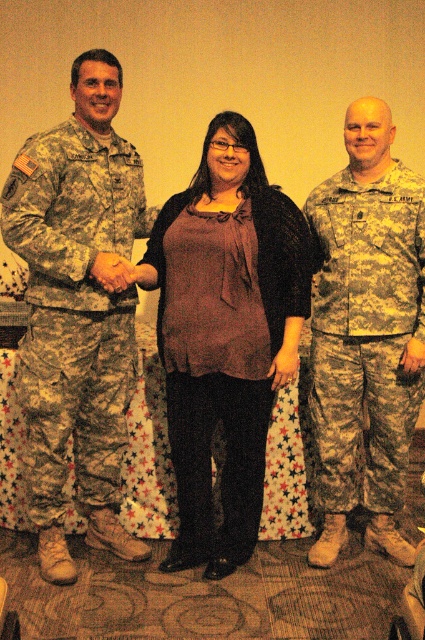
Question: Which object is farther from the camera taking this photo?

Choices:
 (A) matte brown blouse at center
 (B) camouflage uniform at left
 (C) camouflage uniform at center

Answer: (C)

Question: Does camouflage uniform at left appear on the right side of camouflage uniform at center?

Choices:
 (A) no
 (B) yes

Answer: (A)

Question: Which object is positioned closest to the matte brown blouse at center?

Choices:
 (A) camouflage uniform at left
 (B) camouflage uniform at center

Answer: (A)

Question: Is matte brown blouse at center bigger than camouflage uniform at center?

Choices:
 (A) no
 (B) yes

Answer: (B)

Question: Can you confirm if camouflage uniform at left is smaller than matte brown blouse at center?

Choices:
 (A) no
 (B) yes

Answer: (A)

Question: Which of the following is the farthest from the observer?

Choices:
 (A) matte brown blouse at center
 (B) camouflage uniform at left

Answer: (A)